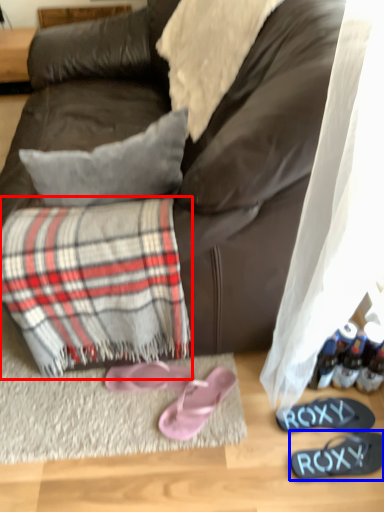
Question: Which object appears closest to the camera in this image, flannel (highlighted by a red box) or footwear (highlighted by a blue box)?

Choices:
 (A) flannel
 (B) footwear

Answer: (A)